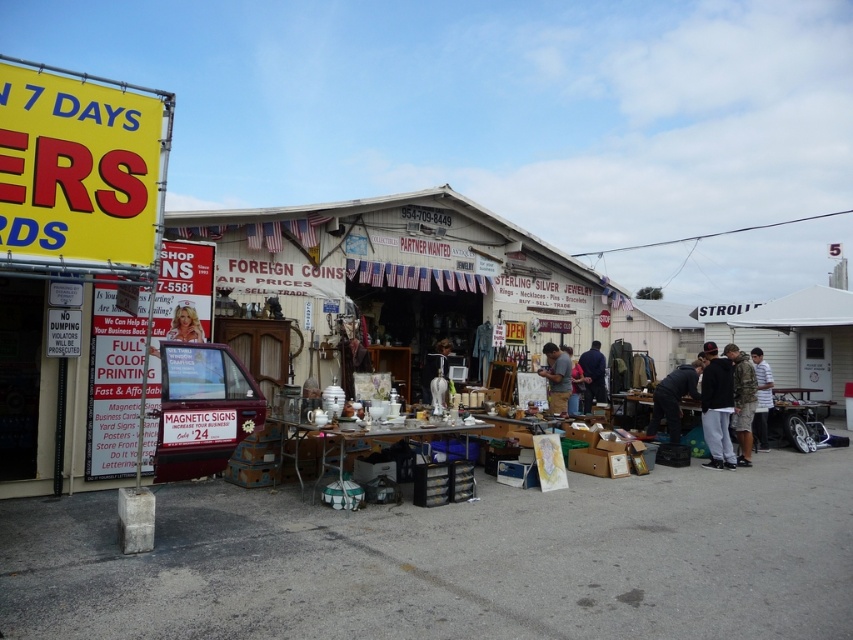
Question: Based on their relative distances, which object is nearer to the white striped shirt at center?

Choices:
 (A) dark gray fabric jacket at lower right
 (B) black cotton pants at lower right
 (C) matte gray shirt at center

Answer: (A)

Question: Is camouflage uniform at center thinner than dark blue jeans at center?

Choices:
 (A) no
 (B) yes

Answer: (A)

Question: Estimate the real-world distances between objects in this image. Which object is closer to the camouflage uniform at center?

Choices:
 (A) dark gray fabric jacket at lower right
 (B) white striped shirt at center
 (C) matte gray shirt at center

Answer: (A)

Question: Does matte gray shirt at center lie behind white striped shirt at center?

Choices:
 (A) yes
 (B) no

Answer: (B)

Question: Among these objects, which one is farthest from the camera?

Choices:
 (A) black cotton pants at lower right
 (B) dark gray fabric jacket at lower right
 (C) matte gray shirt at center

Answer: (C)

Question: Does black cotton pants at lower right have a larger size compared to white striped shirt at center?

Choices:
 (A) no
 (B) yes

Answer: (B)